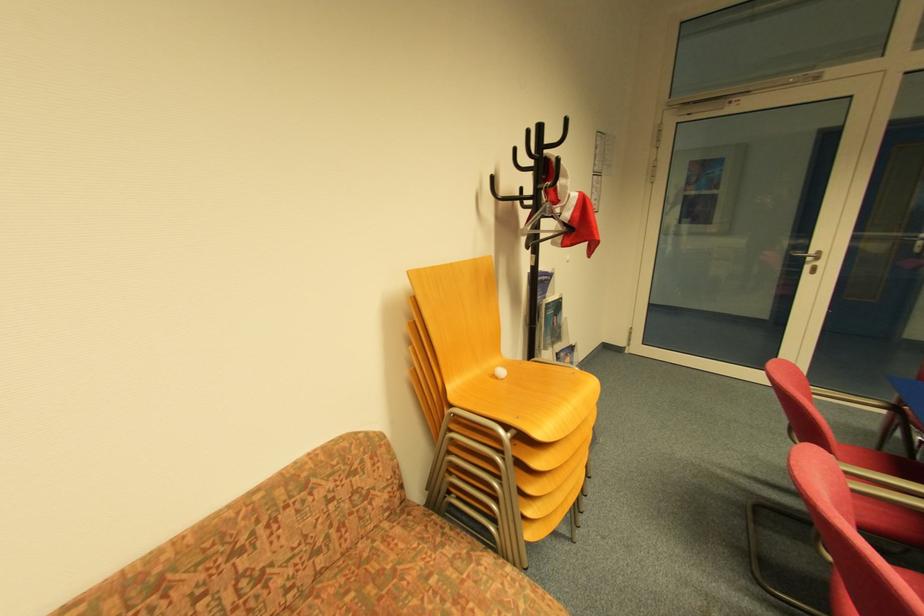
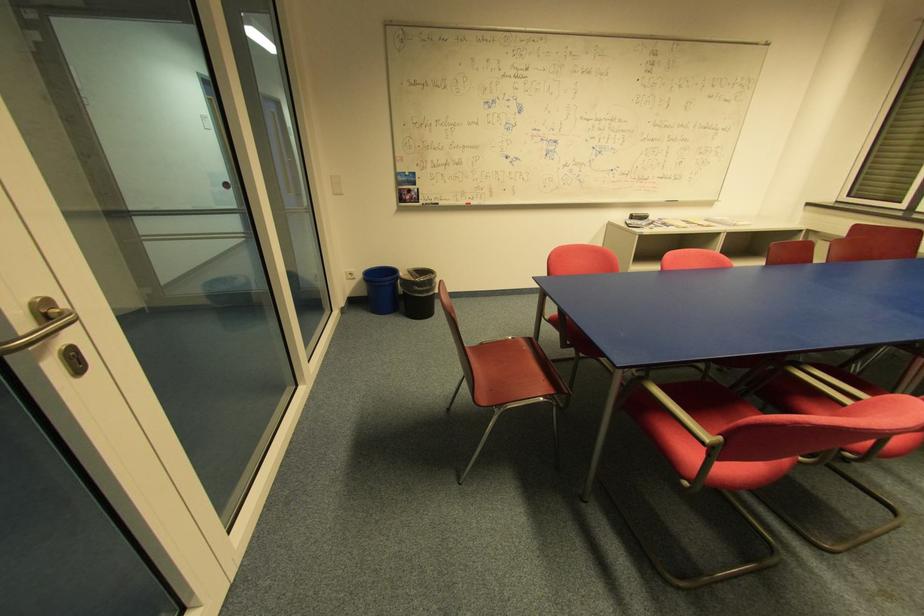
Where in the second image is the point corresponding to point (823, 254) from the first image?

(51, 304)